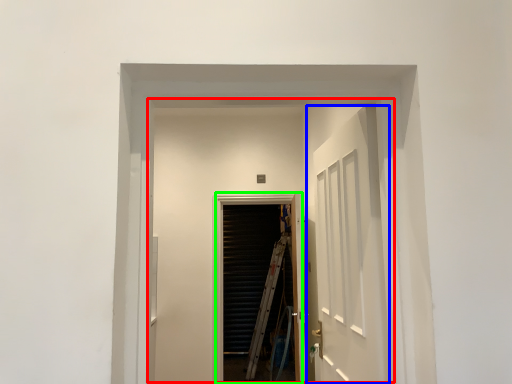
Question: Considering the real-world distances, which object is closest to elevator (highlighted by a red box)? door (highlighted by a blue box) or screen door (highlighted by a green box).

Choices:
 (A) door
 (B) screen door

Answer: (B)